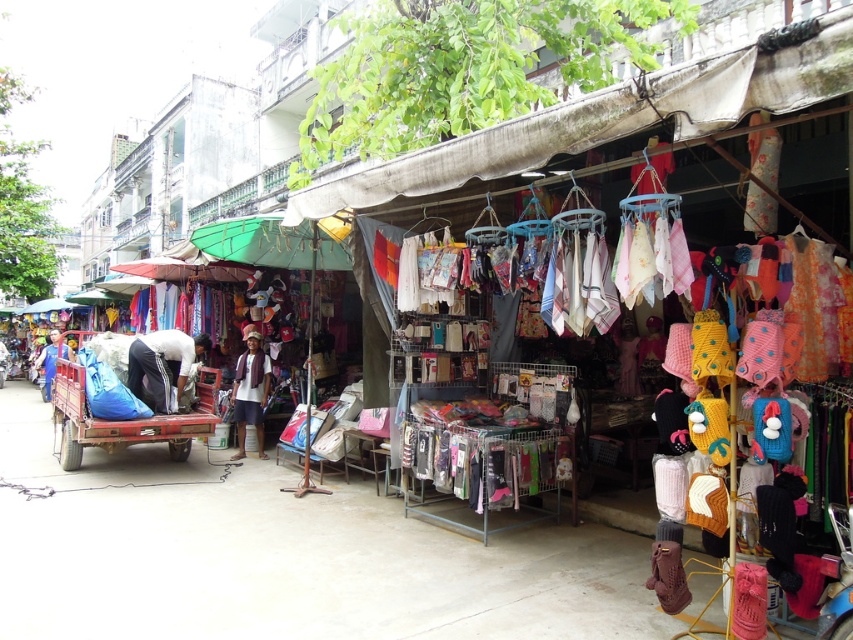
You are a customer at the market and want to know if the white cotton shirt at center can fit into the white fabric bag at left. Can it fit based on their sizes?

The white cotton shirt at center is wider than the white fabric bag at left, so it may not fit inside the bag.

You are standing at the entrance of the market and see the white cotton shirt at center. If you want to reach it quickly, should you walk straight ahead or turn left?

Since the white cotton shirt at center is only 28.65 feet away from the viewer, walking straight ahead would be the quickest path to reach it.

You are a delivery person who needs to place a large box between the matte red cart at lower left and the blue fabric at left. Can you fit the box in the space between them if the box requires 20 feet of space?

The distance between the matte red cart at lower left and the blue fabric at left is 22.33 feet, which is more than enough to accommodate the 20 feet needed for the large box.